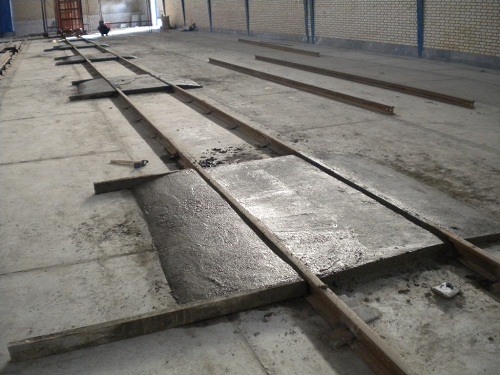
Image resolution: width=500 pixels, height=375 pixels. I want to click on dirt debris on the floor, so click(x=213, y=154), click(x=124, y=232), click(x=442, y=183), click(x=209, y=81).